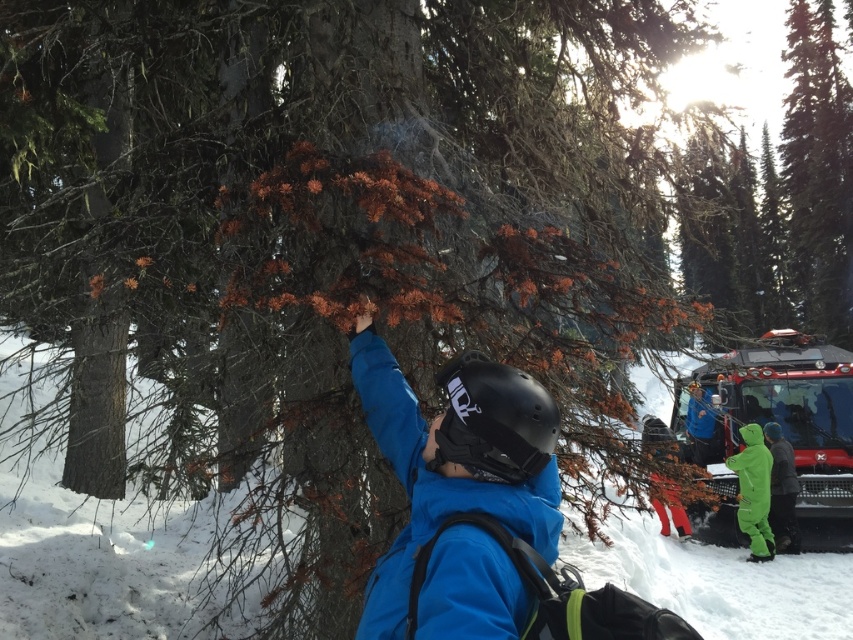
You are trying to decide whether to place a small tent on the white powdery snow at center. The tent requires a space wider than the blue matte jacket at center. Can the snow area accommodate the tent?

The white powdery snow at center might be wider than blue matte jacket at center, so it is possible that the snow area can accommodate the tent.

You are standing at the point marked as point (97, 560) in the image. Looking around, you see a person in a blue jacket near a tree branch and a red vehicle in the background. What surface are you currently standing on?

You are standing on white powdery snow at center.

Based on the photo, you are standing in the winter forest scene and want to take a photo. There are two points marked in the image. The first point is at coordinate point (6, 381) and the second is at point (720, 436). Which point will appear larger in your photo?

Point (6, 381) will appear larger in the photo because it is closer to the camera than point (720, 436).